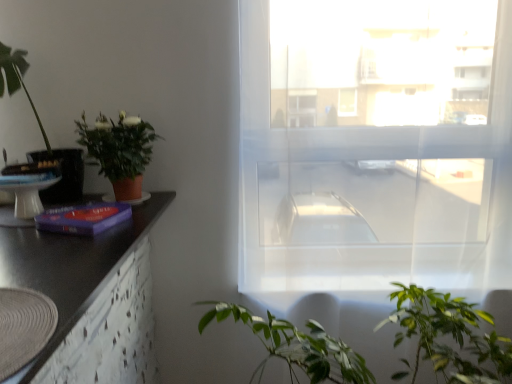
Identify the location of black matte counter top at left. Image resolution: width=512 pixels, height=384 pixels. (71, 261).

Identify the location of transparent fabric window at center. Image resolution: width=512 pixels, height=384 pixels. (375, 144).

The image size is (512, 384). Describe the element at coordinates (83, 218) in the screenshot. I see `purple matte book at left` at that location.

What do you see at coordinates (446, 335) in the screenshot? I see `green leafy plant at lower center` at bounding box center [446, 335].

Describe the element at coordinates (27, 192) in the screenshot. I see `white glossy round table at left` at that location.

Measure the distance between point (1, 189) and camera.

The distance of point (1, 189) from camera is 3.95 feet.

What are the coordinates of `green leafy plant at left, which appears as the 1th houseplant when viewed from the left` in the screenshot? It's located at (42, 132).

What is the approximate height of matte terracotta pot at left, the second houseplant in the left-to-right sequence?

matte terracotta pot at left, the second houseplant in the left-to-right sequence, is 10.97 inches tall.

Looking at this image, what is the approximate width of matte terracotta pot at left, the 1th houseplant positioned from the right?

matte terracotta pot at left, the 1th houseplant positioned from the right, is 8.75 inches in width.

The image size is (512, 384). Find the location of `black matte counter top at left`. black matte counter top at left is located at coordinates (71, 261).

In terms of height, does transparent fabric window at center look taller or shorter compared to purple matte book at left?

Answer: transparent fabric window at center is taller than purple matte book at left.

Is transparent fabric window at center positioned beyond the bounds of purple matte book at left?

Absolutely, transparent fabric window at center is external to purple matte book at left.

At what (x,y) coordinates should I click in order to perform the action: click on book in front of the transparent fabric window at center. Please return your answer as a coordinate pair (x, y). Looking at the image, I should click on (83, 218).

Is white glossy round table at left aimed at green leafy plant at left, the second houseplant positioned from the right?

No, white glossy round table at left is not aimed at green leafy plant at left, the second houseplant positioned from the right.

Would you consider white glossy round table at left to be distant from green leafy plant at left, which appears as the 1th houseplant when viewed from the left?

That's not correct — white glossy round table at left is a little close to green leafy plant at left, which appears as the 1th houseplant when viewed from the left.

Considering the sizes of white glossy round table at left and green leafy plant at left, the second houseplant positioned from the right, in the image, is white glossy round table at left bigger or smaller than green leafy plant at left, the second houseplant positioned from the right,?

white glossy round table at left is smaller than green leafy plant at left, the second houseplant positioned from the right.

Considering the sizes of white glossy round table at left and green leafy plant at left, which appears as the 1th houseplant when viewed from the left, in the image, is white glossy round table at left wider or thinner than green leafy plant at left, which appears as the 1th houseplant when viewed from the left,?

Clearly, white glossy round table at left has less width compared to green leafy plant at left, which appears as the 1th houseplant when viewed from the left.

How different are the orientations of purple matte book at left and matte terracotta pot at left, the 1th houseplant positioned from the right, in degrees?

The facing directions of purple matte book at left and matte terracotta pot at left, the 1th houseplant positioned from the right, are 17.3 degrees apart.

Which object is wider, purple matte book at left or matte terracotta pot at left, the 1th houseplant positioned from the right?

purple matte book at left is wider.

From the image's perspective, is purple matte book at left on matte terracotta pot at left, the second houseplant in the left-to-right sequence?

Actually, purple matte book at left appears below matte terracotta pot at left, the second houseplant in the left-to-right sequence, in the image.

Is purple matte book at left not near matte terracotta pot at left, the 1th houseplant positioned from the right?

They are positioned close to each other.

From the picture: From a real-world perspective, which is physically below, black matte counter top at left or white glossy round table at left?

black matte counter top at left, from a real-world perspective.

Considering the positions of objects black matte counter top at left and white glossy round table at left in the image provided, who is more to the left, black matte counter top at left or white glossy round table at left?

Positioned to the left is white glossy round table at left.

In the scene shown: Between black matte counter top at left and white glossy round table at left, which one has larger size?

black matte counter top at left.

What's the angular difference between black matte counter top at left and transparent fabric window at center's facing directions?

black matte counter top at left and transparent fabric window at center are facing 3.99e-05 degrees away from each other.

Considering the positions of point (47, 346) and point (502, 62), is point (47, 346) closer or farther from the camera than point (502, 62)?

Point (47, 346) is closer to the camera than point (502, 62).

From the image's perspective, who appears lower, black matte counter top at left or transparent fabric window at center?

black matte counter top at left appears lower in the image.

Considering the sizes of black matte counter top at left and transparent fabric window at center in the image, is black matte counter top at left wider or thinner than transparent fabric window at center?

Considering their sizes, black matte counter top at left looks broader than transparent fabric window at center.

Which object is further away from the camera, white glossy round table at left or black matte counter top at left?

white glossy round table at left is more distant.

Image resolution: width=512 pixels, height=384 pixels. In order to click on round table above the black matte counter top at left (from a real-world perspective) in this screenshot , I will do `click(27, 192)`.

In terms of size, does white glossy round table at left appear bigger or smaller than black matte counter top at left?

white glossy round table at left is smaller than black matte counter top at left.

Is white glossy round table at left inside the boundaries of black matte counter top at left, or outside?

The correct answer is: outside.

Is green leafy plant at lower center to the left of purple matte book at left from the viewer's perspective?

Incorrect, green leafy plant at lower center is not on the left side of purple matte book at left.

Is green leafy plant at lower center positioned far away from purple matte book at left?

That's not correct — green leafy plant at lower center is a little close to purple matte book at left.

From the image's perspective, who appears lower, green leafy plant at lower center or purple matte book at left?

green leafy plant at lower center.

From a real-world perspective, is green leafy plant at lower center over purple matte book at left?

Incorrect, from a real-world perspective, green leafy plant at lower center is lower than purple matte book at left.

Identify the location of window that appears behind the purple matte book at left. The height and width of the screenshot is (384, 512). click(375, 144).

From the image's perspective, count 2nd houseplants upward from the white glossy round table at left and point to it. Please provide its 2D coordinates.

[(42, 132)]

In the scene shown: From the image, which object appears to be nearer to black matte counter top at left, transparent fabric window at center or purple matte book at left?

purple matte book at left is positioned closer to the anchor black matte counter top at left.

Which object lies further to the anchor point green leafy plant at left, which appears as the 1th houseplant when viewed from the left, transparent fabric window at center or matte terracotta pot at left, the second houseplant in the left-to-right sequence?

Among the two, transparent fabric window at center is located further to green leafy plant at left, which appears as the 1th houseplant when viewed from the left.

Looking at this image, considering their positions, is green leafy plant at lower center positioned further to transparent fabric window at center than green leafy plant at left, the second houseplant positioned from the right?

green leafy plant at left, the second houseplant positioned from the right.

Looking at the image, which one is located closer to black matte counter top at left, transparent fabric window at center or white glossy round table at left?

white glossy round table at left lies closer to black matte counter top at left than the other object.

Based on the photo, which object lies nearer to the anchor point black matte counter top at left, green leafy plant at left, the second houseplant positioned from the right, or purple matte book at left?

Among the two, purple matte book at left is located nearer to black matte counter top at left.

Looking at the image, which one is located closer to green leafy plant at left, which appears as the 1th houseplant when viewed from the left, green leafy plant at lower center or purple matte book at left?

purple matte book at left.

Estimate the real-world distances between objects in this image. Which object is closer to black matte counter top at left, green leafy plant at left, the second houseplant positioned from the right, or transparent fabric window at center?

Based on the image, green leafy plant at left, the second houseplant positioned from the right, appears to be nearer to black matte counter top at left.

When comparing their distances from transparent fabric window at center, does black matte counter top at left or purple matte book at left seem further?

The object further to transparent fabric window at center is black matte counter top at left.

Image resolution: width=512 pixels, height=384 pixels. What are the coordinates of `counter top between white glossy round table at left and green leafy plant at lower center` in the screenshot? It's located at (71, 261).

The height and width of the screenshot is (384, 512). In order to click on counter top between green leafy plant at left, the second houseplant positioned from the right, and transparent fabric window at center from left to right in this screenshot , I will do `click(71, 261)`.

Locate an element on the screen. This screenshot has height=384, width=512. round table between green leafy plant at left, which appears as the 1th houseplant when viewed from the left, and purple matte book at left in the up-down direction is located at coordinates (27, 192).

The image size is (512, 384). I want to click on counter top between green leafy plant at left, which appears as the 1th houseplant when viewed from the left, and green leafy plant at lower center, in the horizontal direction, so click(71, 261).